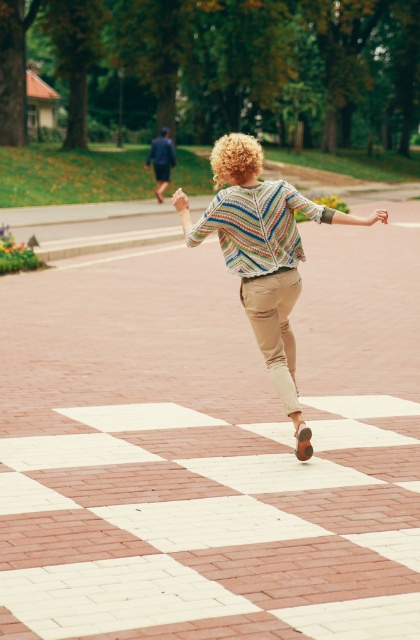
Question: Considering the real-world distances, which object is farthest from the curly blonde hair at center?

Choices:
 (A) brick pavement at center
 (B) multicolored knitted sweater at center
 (C) dark blue suit at upper left

Answer: (C)

Question: Can you confirm if multicolored knitted sweater at center is thinner than dark blue suit at upper left?

Choices:
 (A) no
 (B) yes

Answer: (A)

Question: Which point is closer to the camera?

Choices:
 (A) dark blue suit at upper left
 (B) multicolored knitted sweater at center
 (C) brick pavement at center
 (D) curly blonde hair at center

Answer: (C)

Question: Which object is positioned farthest from the curly blonde hair at center?

Choices:
 (A) brick pavement at center
 (B) dark blue suit at upper left

Answer: (B)

Question: Is multicolored knitted sweater at center below dark blue suit at upper left?

Choices:
 (A) yes
 (B) no

Answer: (A)

Question: Does brick pavement at center have a larger size compared to multicolored knitted sweater at center?

Choices:
 (A) yes
 (B) no

Answer: (A)